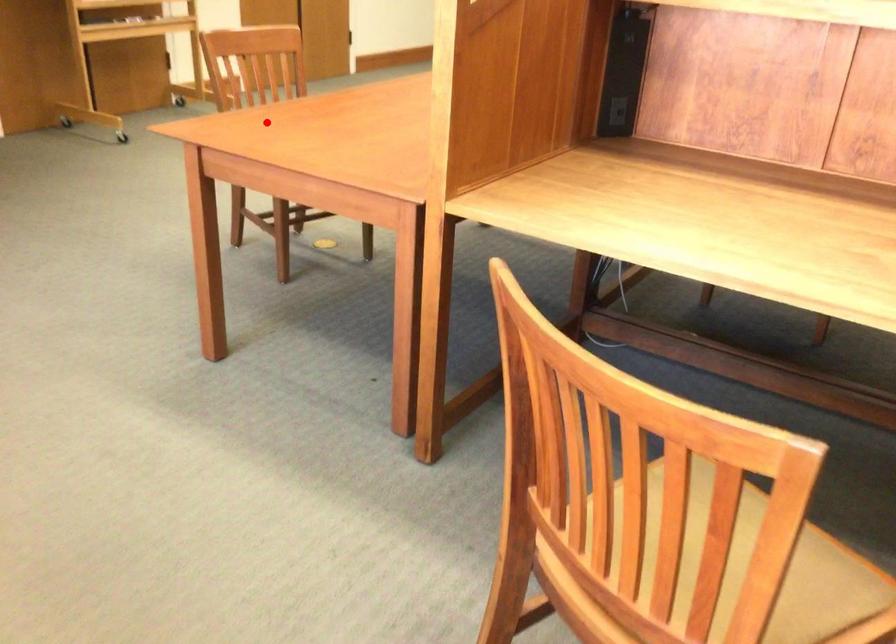
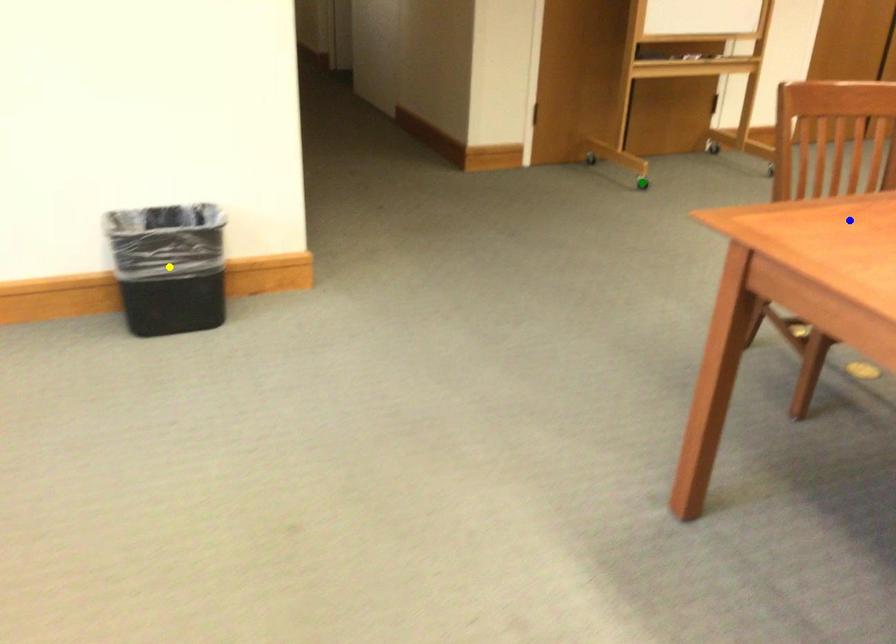
Question: I am providing you with two images of the same scene from different viewpoints. A red point is marked on the first image. You are given multiple points on the second image. Which point in image 2 is actually the same real-world point as the red point in image 1?

Choices:
 (A) blue point
 (B) green point
 (C) yellow point

Answer: (A)